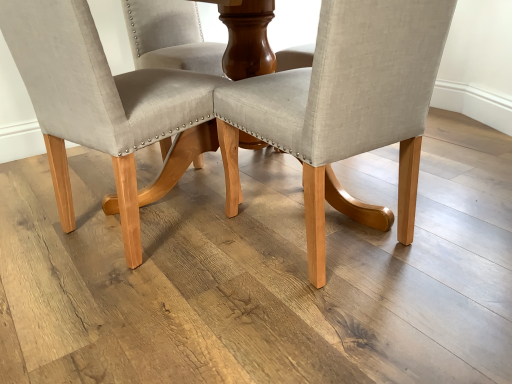
Question: Relative to beige fabric chair at center, placed as the 1th chair when sorted from right to left, is beige fabric chair at center, which appears as the first chair when viewed from the left, in front or behind?

Choices:
 (A) front
 (B) behind

Answer: (B)

Question: In the image, is beige fabric chair at center, which appears as the first chair when viewed from the left, on the left side or the right side of beige fabric chair at center, placed as the 1th chair when sorted from right to left?

Choices:
 (A) left
 (B) right

Answer: (A)

Question: From a real-world perspective, relative to beige fabric chair at center, which ranks as the second chair in left-to-right order, is beige fabric chair at center, the 2th chair from the right, vertically above or below?

Choices:
 (A) below
 (B) above

Answer: (B)

Question: From a real-world perspective, is beige fabric chair at center, placed as the 1th chair when sorted from right to left, positioned above or below beige fabric chair at center, the 2th chair from the right?

Choices:
 (A) above
 (B) below

Answer: (B)

Question: Considering their positions, is beige fabric chair at center, which ranks as the second chair in left-to-right order, located in front of or behind beige fabric chair at center, which appears as the first chair when viewed from the left?

Choices:
 (A) front
 (B) behind

Answer: (A)

Question: Looking at the image, does beige fabric chair at center, placed as the 1th chair when sorted from right to left, seem bigger or smaller compared to beige fabric chair at center, the 2th chair from the right?

Choices:
 (A) small
 (B) big

Answer: (A)

Question: In the image, is beige fabric chair at center, which ranks as the second chair in left-to-right order, on the left side or the right side of beige fabric chair at center, the 2th chair from the right?

Choices:
 (A) right
 (B) left

Answer: (A)